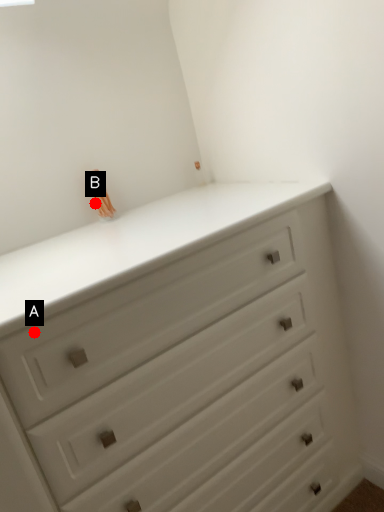
Question: Two points are circled on the image, labeled by A and B beside each circle. Which point is closer to the camera taking this photo?

Choices:
 (A) A is closer
 (B) B is closer

Answer: (A)